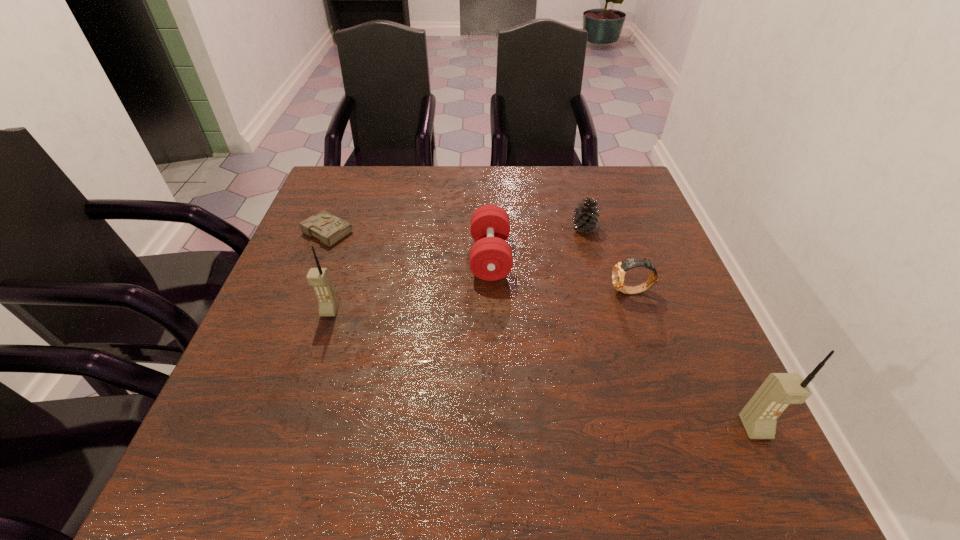
The width and height of the screenshot is (960, 540). Find the location of `vacant region located on the right of the diary`. vacant region located on the right of the diary is located at coordinates (426, 231).

Find the location of `free region located 0.310m on the right of the third object from left to right`. free region located 0.310m on the right of the third object from left to right is located at coordinates (636, 257).

Identify the location of free location located on the face of the watch. This screenshot has height=540, width=960. (518, 292).

This screenshot has height=540, width=960. In order to click on vacant space situated 0.160m on the face of the watch in this screenshot , I will do `click(540, 292)`.

The height and width of the screenshot is (540, 960). What are the coordinates of `vacant space located 0.140m on the face of the watch` in the screenshot? It's located at (549, 292).

Image resolution: width=960 pixels, height=540 pixels. Identify the location of object present at the near edge. (759, 417).

Locate an element on the screen. The width and height of the screenshot is (960, 540). cellular telephone situated at the left edge is located at coordinates (319, 278).

At what (x,y) coordinates should I click in order to perform the action: click on diary situated at the left edge. Please return your answer as a coordinate pair (x, y). This screenshot has height=540, width=960. Looking at the image, I should click on (329, 229).

Identify the location of cellular telephone that is positioned at the right edge. pyautogui.click(x=759, y=417).

The image size is (960, 540). I want to click on pinecone that is at the right edge, so click(585, 218).